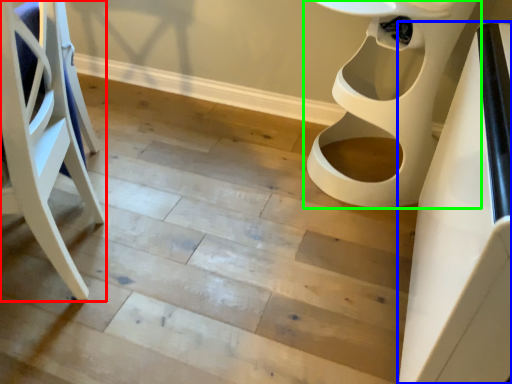
Question: Which object is the farthest from furniture (highlighted by a red box)? Choose among these: table (highlighted by a blue box) or toilet (highlighted by a green box).

Choices:
 (A) table
 (B) toilet

Answer: (B)